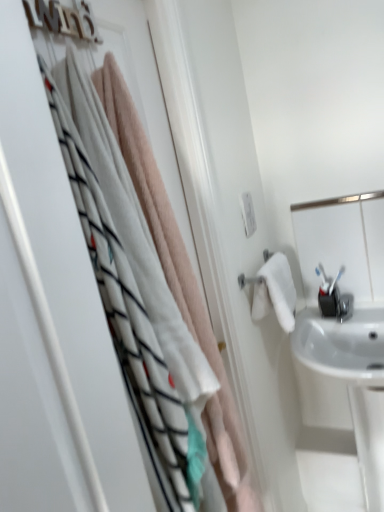
Image resolution: width=384 pixels, height=512 pixels. I want to click on soft pink towel at upper left, so click(65, 266).

Describe the element at coordinates (342, 407) in the screenshot. I see `white glossy sink at right` at that location.

Where is `white glossy sink at right`? This screenshot has width=384, height=512. white glossy sink at right is located at coordinates (342, 407).

What do you see at coordinates (342, 242) in the screenshot?
I see `white glossy mirror at upper right` at bounding box center [342, 242].

I want to click on soft pink towel at upper left, so click(x=65, y=266).

Is white glossy mirror at upper right wider than white glossy sink at right?

No, white glossy mirror at upper right is not wider than white glossy sink at right.

Would you say white glossy mirror at upper right is inside or outside white glossy sink at right?

white glossy mirror at upper right exists outside the volume of white glossy sink at right.

From a real-world perspective, does white glossy mirror at upper right stand above white glossy sink at right?

Yes, from a real-world perspective, white glossy mirror at upper right is on top of white glossy sink at right.

The image size is (384, 512). I want to click on sink on the right of the white glossy mirror at upper right, so click(342, 407).

Does white glossy mirror at upper right lie in front of soft pink towel at upper left?

That is False.

Can you confirm if white glossy mirror at upper right is bigger than soft pink towel at upper left?

Incorrect, white glossy mirror at upper right is not larger than soft pink towel at upper left.

Which is in front, point (360, 267) or point (136, 506)?

The point (136, 506) is in front.

Considering their positions, is white glossy sink at right located in front of or behind soft pink towel at upper left?

Visually, white glossy sink at right is located behind soft pink towel at upper left.

Consider the image. Can you tell me how much white glossy sink at right and soft pink towel at upper left differ in facing direction?

90.3 degrees.

From the image's perspective, is white glossy sink at right located above or below soft pink towel at upper left?

white glossy sink at right is below soft pink towel at upper left.

Who is taller, white glossy sink at right or soft pink towel at upper left?

soft pink towel at upper left.

Does white glossy sink at right have a greater height compared to white glossy mirror at upper right?

Yes.

Is white glossy sink at right to the right of white glossy mirror at upper right from the viewer's perspective?

Indeed, white glossy sink at right is positioned on the right side of white glossy mirror at upper right.

Between white glossy sink at right and white glossy mirror at upper right, which one is positioned behind?

white glossy mirror at upper right is further away from the camera.

From a real-world perspective, is white glossy sink at right on top of white glossy mirror at upper right?

No.

From the image's perspective, is soft pink towel at upper left on top of white glossy sink at right?

Yes.

From a real-world perspective, who is located higher, soft pink towel at upper left or white glossy sink at right?

In real-world perspective, soft pink towel at upper left is above.

In terms of height, does soft pink towel at upper left look taller or shorter compared to white glossy sink at right?

Clearly, soft pink towel at upper left is taller compared to white glossy sink at right.

Measure the distance from soft pink towel at upper left to white glossy sink at right.

A distance of 1.27 meters exists between soft pink towel at upper left and white glossy sink at right.

In the image, is soft pink towel at upper left positioned in front of or behind white glossy mirror at upper right?

Clearly, soft pink towel at upper left is in front of white glossy mirror at upper right.

Which of these two, soft pink towel at upper left or white glossy mirror at upper right, stands taller?

With more height is soft pink towel at upper left.

From the image's perspective, who appears lower, soft pink towel at upper left or white glossy mirror at upper right?

From the image's view, soft pink towel at upper left is below.

Where is `mirror that appears above the white glossy sink at right (from the image's perspective)`? This screenshot has width=384, height=512. mirror that appears above the white glossy sink at right (from the image's perspective) is located at coordinates (342, 242).

I want to click on closet that appears in front of the white glossy mirror at upper right, so click(65, 266).

Which object lies nearer to the anchor point white glossy sink at right, soft pink towel at upper left or white glossy mirror at upper right?

The object closer to white glossy sink at right is white glossy mirror at upper right.

Estimate the real-world distances between objects in this image. Which object is closer to soft pink towel at upper left, white glossy sink at right or white glossy mirror at upper right?

white glossy mirror at upper right lies closer to soft pink towel at upper left than the other object.

From the image, which object appears to be nearer to white glossy sink at right, white glossy mirror at upper right or soft pink towel at upper left?

white glossy mirror at upper right is positioned closer to the anchor white glossy sink at right.

In the scene shown: From the image, which object appears to be nearer to soft pink towel at upper left, white glossy mirror at upper right or white glossy sink at right?

white glossy mirror at upper right is closer to soft pink towel at upper left.

When comparing their distances from white glossy mirror at upper right, does soft pink towel at upper left or white glossy sink at right seem further?

The object further to white glossy mirror at upper right is soft pink towel at upper left.

When comparing their distances from white glossy mirror at upper right, does white glossy sink at right or soft pink towel at upper left seem further?

soft pink towel at upper left lies further to white glossy mirror at upper right than the other object.

I want to click on sink between soft pink towel at upper left and white glossy mirror at upper right in the front-back direction, so click(342, 407).